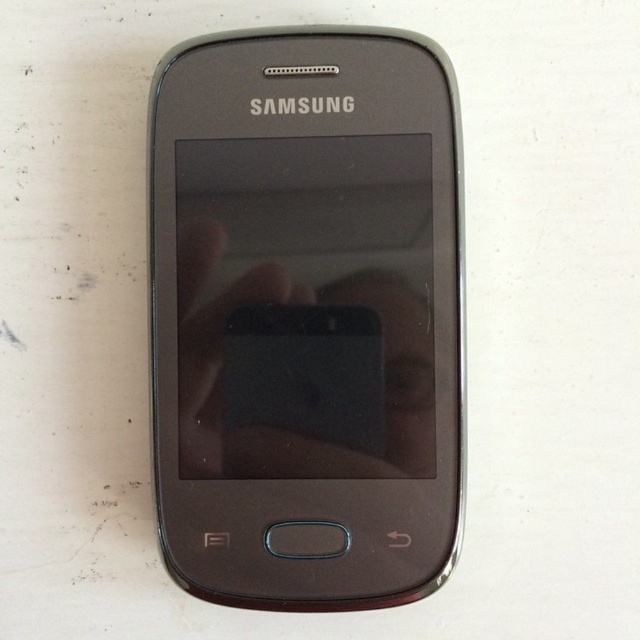
You are holding the transparent matte hand at center and want to pick up the matte black smartphone at center. Can you fit your hand around the smartphone?

The matte black smartphone at center is bigger than the transparent matte hand at center, so your hand cannot fully wrap around it.